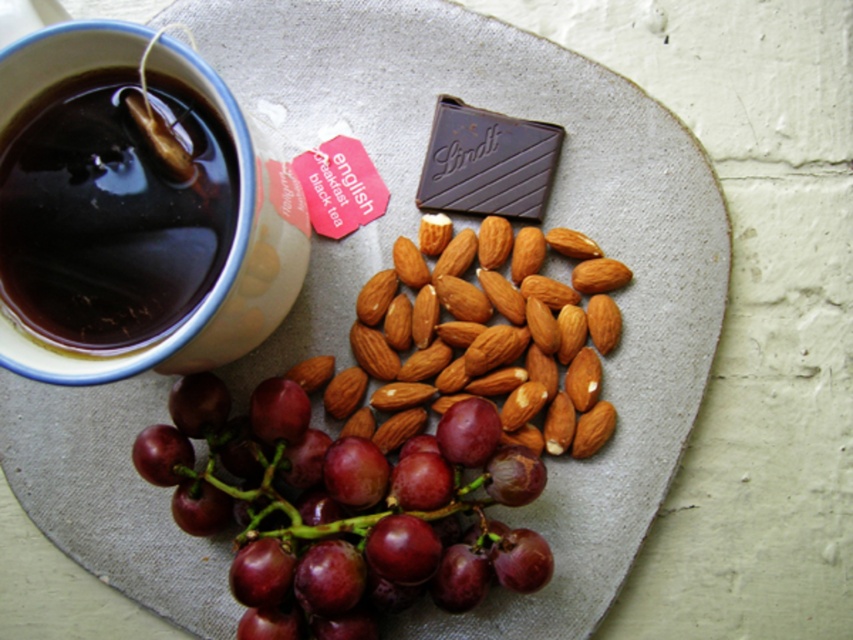
Between dark brown liquid at upper left and dark chocolate bar at center, which one appears on the left side from the viewer's perspective?

dark brown liquid at upper left is more to the left.

Is point (170, 188) positioned in front of point (450, 113)?

Yes, it is.

Describe the element at coordinates (111, 212) in the screenshot. I see `dark brown liquid at upper left` at that location.

Image resolution: width=853 pixels, height=640 pixels. In order to click on dark brown liquid at upper left in this screenshot , I will do `click(111, 212)`.

Does shiny purple grapes at lower center have a smaller size compared to dark chocolate bar at center?

No.

Is shiny purple grapes at lower center positioned behind dark chocolate bar at center?

No, it is in front of dark chocolate bar at center.

Does point (195, 529) come farther from viewer compared to point (457, 188)?

No, (195, 529) is closer to viewer.

Locate an element on the screen. Image resolution: width=853 pixels, height=640 pixels. shiny purple grapes at lower center is located at coordinates (341, 509).

Is shiny purple grapes at lower center above smooth brown almonds at center?

Incorrect, shiny purple grapes at lower center is not positioned above smooth brown almonds at center.

Which of these two, shiny purple grapes at lower center or smooth brown almonds at center, stands taller?

Standing taller between the two is shiny purple grapes at lower center.

Is point (236, 628) in front of point (451, 336)?

Yes, it is.

Locate an element on the screen. The image size is (853, 640). shiny purple grapes at lower center is located at coordinates 341,509.